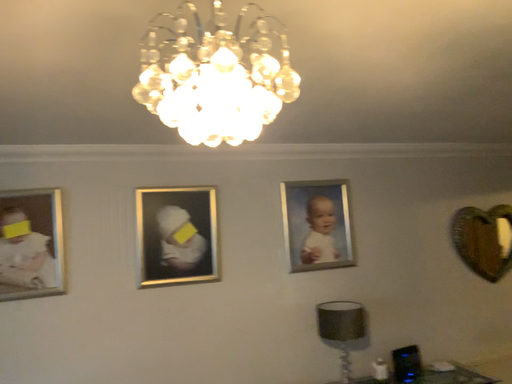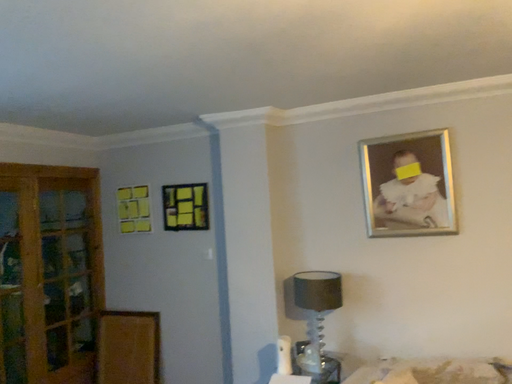
Question: Which way did the camera rotate in the video?

Choices:
 (A) rotated left
 (B) rotated right

Answer: (A)